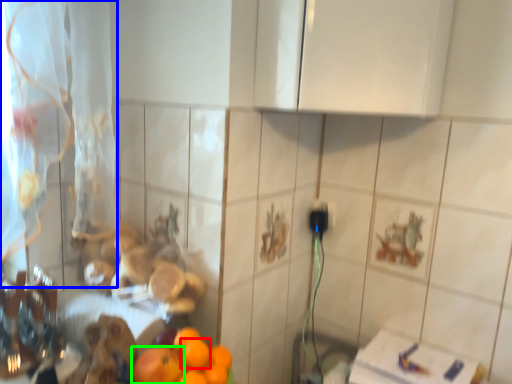
Question: Estimate the real-world distances between objects in this image. Which object is closer to orange (highlighted by a red box), curtain (highlighted by a blue box) or orange (highlighted by a green box)?

Choices:
 (A) curtain
 (B) orange

Answer: (B)